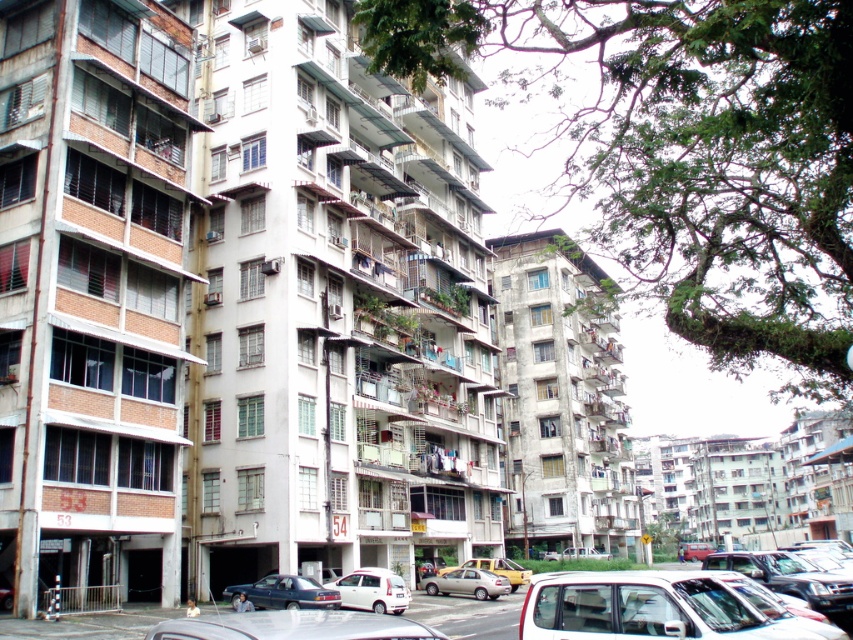
Based on the photo, you are a delivery person trying to park your vehicle between the dark blue metallic car at lower center and the white matte pickup truck at center. Given that your delivery van is 5 meters long, can you fit it in the space between these two vehicles?

The dark blue metallic car at lower center is smaller than the white matte pickup truck at center, but the exact distance between them isn

You are a delivery driver who needs to park your vehicle in this area. Your car is 1.8 meters wide. You see a white matte car at lower center and a matte red car at center. Can you fit your car between them if there is a space between them?

The white matte car at lower center is narrower than the matte red car at center. However, without knowing the exact width of the space between them, it is impossible to determine if your 1.8 meter wide car can fit. You need to measure the space between them first.

You are standing in the residential area and want to know how far the point at coordinates (x=384, y=627) is from your current position. Can you determine the distance?

The point at coordinates (x=384, y=627) is 14.39 meters away from your current position.